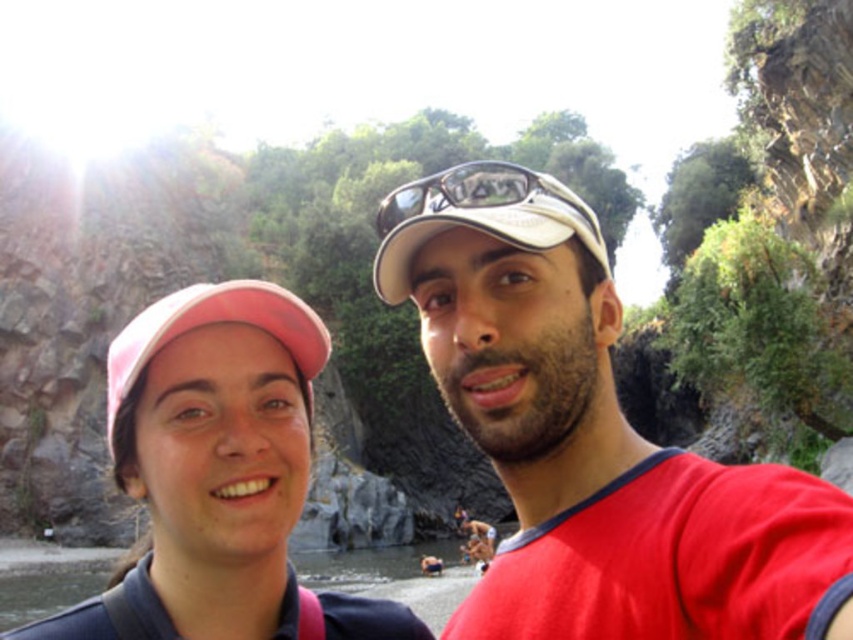
Can you confirm if matte red shirt at center is positioned to the left of pink fabric cap at upper left?

In fact, matte red shirt at center is to the right of pink fabric cap at upper left.

Locate an element on the screen. Image resolution: width=853 pixels, height=640 pixels. matte red shirt at center is located at coordinates (592, 438).

Is pink fabric cap at upper left bigger than matte black goggles at center?

Correct, pink fabric cap at upper left is larger in size than matte black goggles at center.

Who is positioned more to the right, pink fabric cap at upper left or matte black goggles at center?

Positioned to the right is matte black goggles at center.

You are a GUI agent. You are given a task and a screenshot of the screen. Output one action in this format:
    pyautogui.click(x=<x>, y=<y>)
    Task: Click on the pink fabric cap at upper left
    The image size is (853, 640).
    Given the screenshot: What is the action you would take?
    pyautogui.click(x=207, y=465)

Does matte red shirt at center have a lesser width compared to matte black goggles at center?

Incorrect, matte red shirt at center's width is not less than matte black goggles at center's.

Can you confirm if matte red shirt at center is shorter than matte black goggles at center?

Indeed, matte red shirt at center has a lesser height compared to matte black goggles at center.

Find the location of `matte red shirt at center`. matte red shirt at center is located at coordinates coord(592,438).